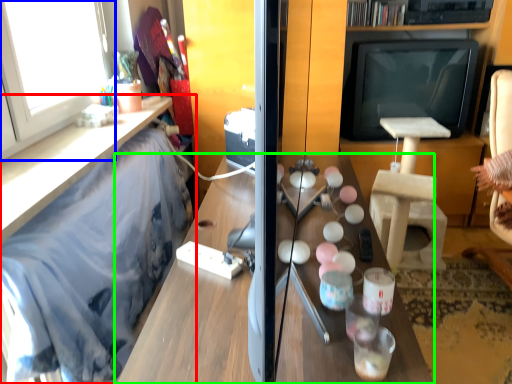
Question: Which object is the closest to the furniture (highlighted by a red box)? Choose among these: window (highlighted by a blue box) or table (highlighted by a green box).

Choices:
 (A) window
 (B) table

Answer: (A)